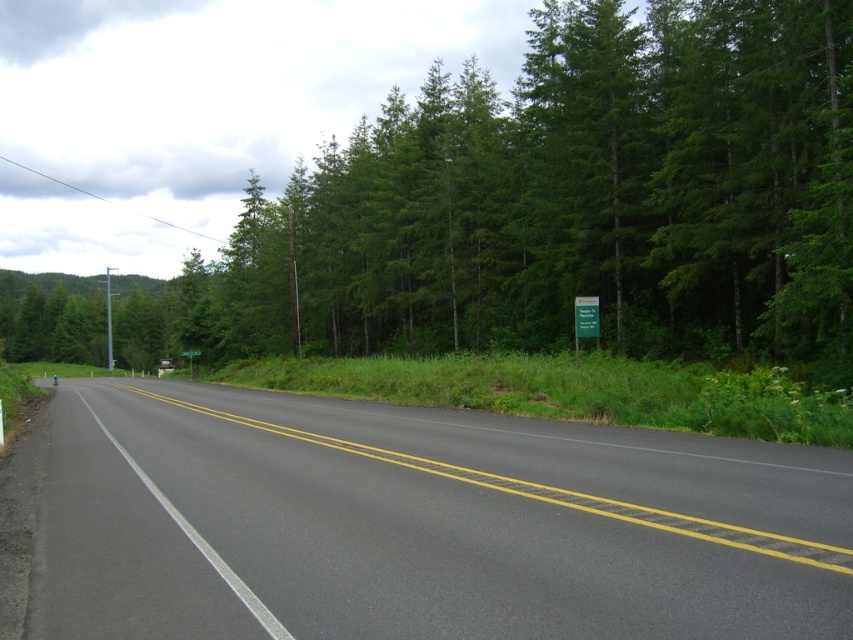
What do you see at coordinates (561, 204) in the screenshot? The height and width of the screenshot is (640, 853). I see `green leafy tree at center` at bounding box center [561, 204].

Measure the distance from green leafy tree at center to green plastic sign at center.

green leafy tree at center and green plastic sign at center are 141.87 meters apart.

Does point (764, 200) come farther from viewer compared to point (189, 355)?

No, (764, 200) is in front of (189, 355).

Locate an element on the screen. The height and width of the screenshot is (640, 853). green leafy tree at center is located at coordinates (561, 204).

Can you confirm if black asphalt highway at center is positioned to the left of green plastic sign at center?

In fact, black asphalt highway at center is to the right of green plastic sign at center.

Looking at this image, who is shorter, black asphalt highway at center or green plastic sign at center?

black asphalt highway at center

Is point (329, 616) farther from camera compared to point (189, 353)?

No, it is in front of (189, 353).

Find the location of a particular element. The height and width of the screenshot is (640, 853). black asphalt highway at center is located at coordinates (422, 524).

Can you confirm if green leafy tree at center is smaller than black asphalt highway at center?

No, green leafy tree at center is not smaller than black asphalt highway at center.

Who is positioned more to the left, green leafy tree at center or black asphalt highway at center?

green leafy tree at center is more to the left.

Between point (766, 116) and point (328, 500), which one is positioned in front?

Positioned in front is point (328, 500).

The height and width of the screenshot is (640, 853). Identify the location of green leafy tree at center. (561, 204).